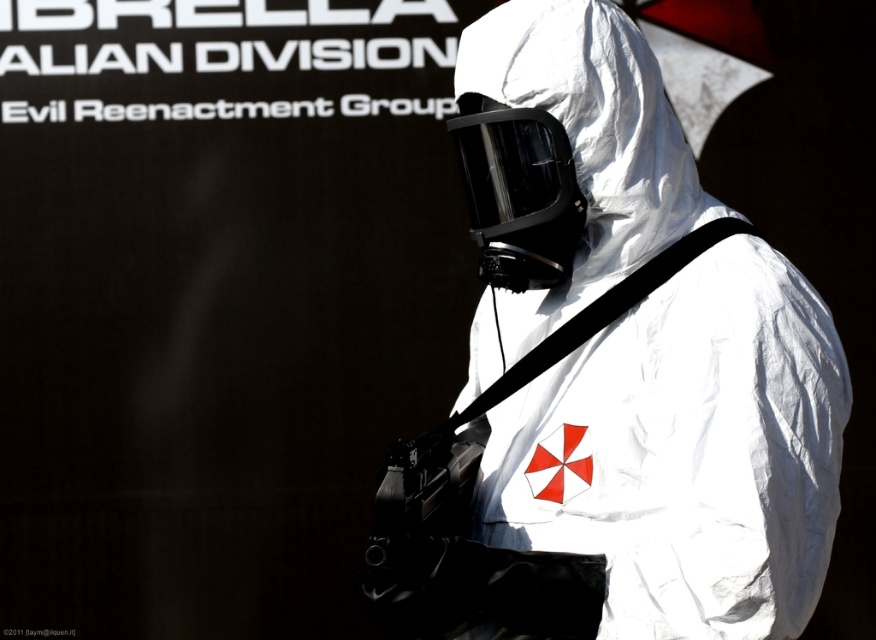
Between point (442, 451) and point (539, 211), which one is positioned in front?

Point (539, 211) is in front.

Does white matte hazmat suit at center appear over white matte helmet at center?

No.

You are a GUI agent. You are given a task and a screenshot of the screen. Output one action in this format:
    pyautogui.click(x=<x>, y=<y>)
    Task: Click on the white matte hazmat suit at center
    This screenshot has width=876, height=640.
    Given the screenshot: What is the action you would take?
    pyautogui.click(x=612, y=374)